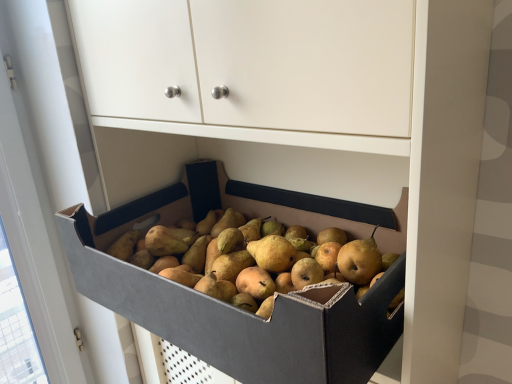
Locate an element on the screen. This screenshot has width=512, height=384. cardboard box filled with pears at center is located at coordinates (230, 306).

What do you see at coordinates (230, 306) in the screenshot? Image resolution: width=512 pixels, height=384 pixels. I see `cardboard box filled with pears at center` at bounding box center [230, 306].

The image size is (512, 384). In order to click on cardboard box filled with pears at center in this screenshot , I will do `click(230, 306)`.